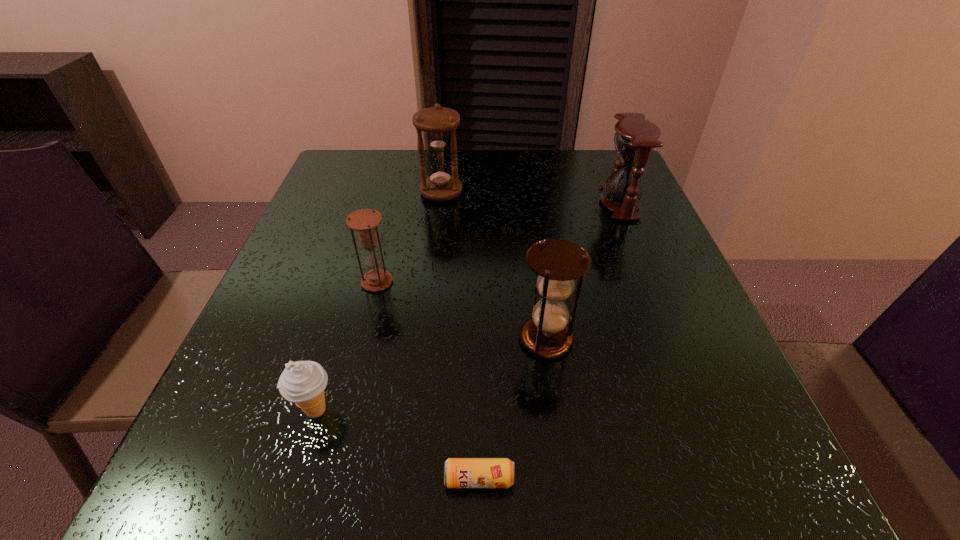
Where is `vacant space that's between the fourth tallest object and the rightmost hourglass`? vacant space that's between the fourth tallest object and the rightmost hourglass is located at coordinates (498, 242).

In order to click on blank region between the nearest object and the icecream in this screenshot , I will do `click(397, 444)`.

Locate an element on the screen. vacant space that's between the leftmost hourglass and the third hourglass from left to right is located at coordinates (462, 310).

The image size is (960, 540). I want to click on free space that is in between the rightmost object and the fourth nearest object, so click(498, 242).

This screenshot has height=540, width=960. Identify the location of vacant region between the second object from right to left and the fourth tallest object. (462, 310).

Where is `free point between the icecream and the shortest object`? free point between the icecream and the shortest object is located at coordinates (397, 444).

Identify the location of vacant region between the third hourglass from right to left and the third hourglass from left to right. (493, 265).

I want to click on object that is the fourth closest to the third hourglass from right to left, so click(x=302, y=382).

Identify the location of the fourth closest object to the leftmost hourglass. The height and width of the screenshot is (540, 960). (458, 472).

The height and width of the screenshot is (540, 960). I want to click on hourglass that can be found as the second closest to the nearest hourglass, so click(x=635, y=138).